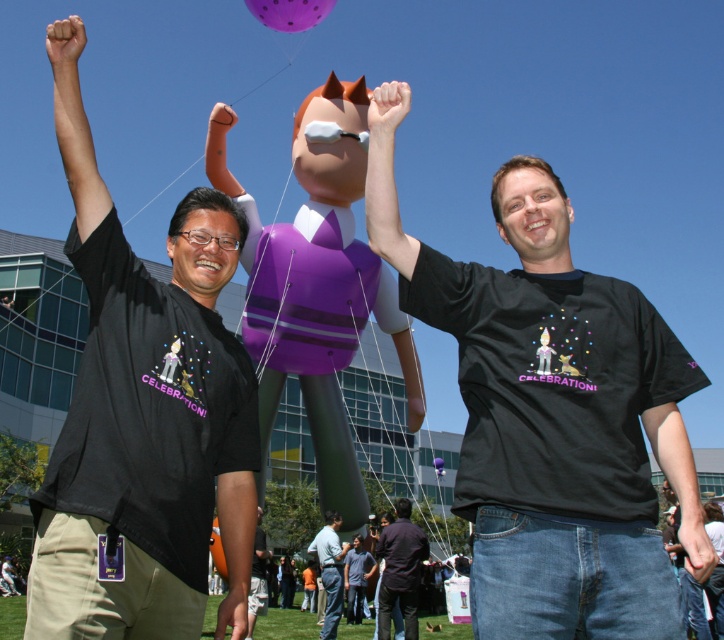
Question: Is dark brown shirt at center closer to the viewer compared to dark gray shirt at center?

Choices:
 (A) no
 (B) yes

Answer: (B)

Question: Which is nearer to the dark gray cotton shirt at center?

Choices:
 (A) black matte pants at lower left
 (B) dark brown shirt at center
 (C) dark gray shirt at center

Answer: (C)

Question: Can you confirm if dark gray shirt at center is positioned below black matte pants at lower left?

Choices:
 (A) yes
 (B) no

Answer: (A)

Question: Considering the real-world distances, which object is farthest from the black matte t-shirt at left?

Choices:
 (A) dark brown shirt at center
 (B) dark gray cotton shirt at center

Answer: (B)

Question: Is black matte t-shirt at center bigger than purple glossy balloon at upper center?

Choices:
 (A) yes
 (B) no

Answer: (B)

Question: Which object appears closest to the camera in this image?

Choices:
 (A) black matte pants at lower left
 (B) purple glossy balloon at upper center

Answer: (A)